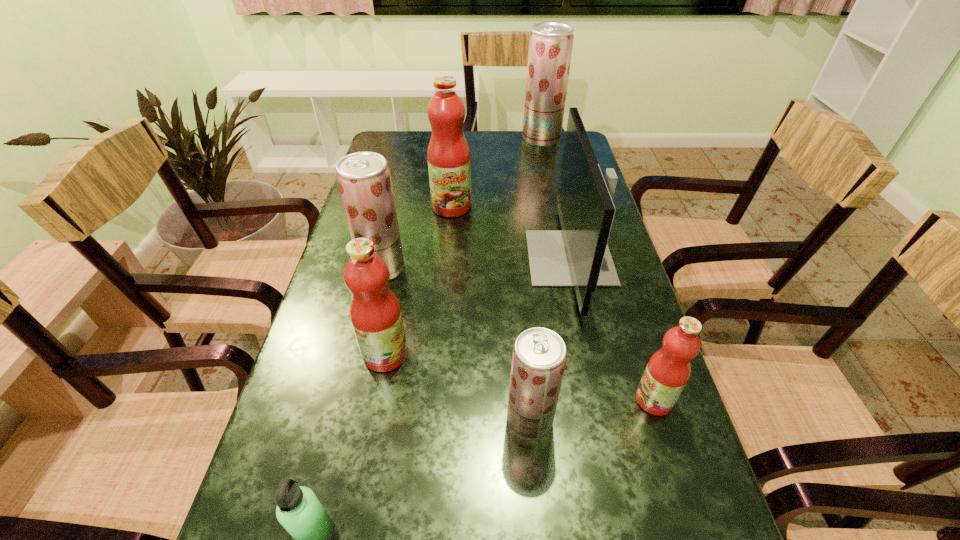
I want to click on the second closest strawberry fruit juice to the farthest fruit juice, so click(x=539, y=355).

Identify the location of strawberry fruit juice that is the second closest to the farthest fruit juice. (539, 355).

Locate an element on the screen. The height and width of the screenshot is (540, 960). the closest pink fruit juice to the shortest object is located at coordinates click(x=375, y=313).

Point out which pink fruit juice is positioned as the nearest to the fifth farthest object. Please provide its 2D coordinates. Your answer should be formatted as a tuple, i.e. [(x, y)], where the tuple contains the x and y coordinates of a point satisfying the conditions above.

[(449, 162)]

At what (x,y) coordinates should I click in order to perform the action: click on vacant space that satisfies the following two spatial constraints: 1. on the front side of the nearest strawberry fruit juice; 2. on the right side of the second smallest strawberry fruit juice. Please return your answer as a coordinate pair (x, y). The width and height of the screenshot is (960, 540). Looking at the image, I should click on (347, 421).

The height and width of the screenshot is (540, 960). I want to click on vacant space that satisfies the following two spatial constraints: 1. on the front label of the farthest pink fruit juice; 2. on the front label of the second farthest pink fruit juice, so click(440, 354).

You are a GUI agent. You are given a task and a screenshot of the screen. Output one action in this format:
    pyautogui.click(x=<x>, y=<y>)
    Task: Click on the free space that satisfies the following two spatial constraints: 1. on the front label of the fifth object from right to left; 2. on the right side of the second strawberry fruit juice from left to right
    
    Given the screenshot: What is the action you would take?
    pyautogui.click(x=435, y=421)

Where is `free space that satisfies the following two spatial constraints: 1. on the back side of the leftmost strawberry fruit juice; 2. on the left side of the biggest strawberry fruit juice`? This screenshot has width=960, height=540. free space that satisfies the following two spatial constraints: 1. on the back side of the leftmost strawberry fruit juice; 2. on the left side of the biggest strawberry fruit juice is located at coordinates (413, 139).